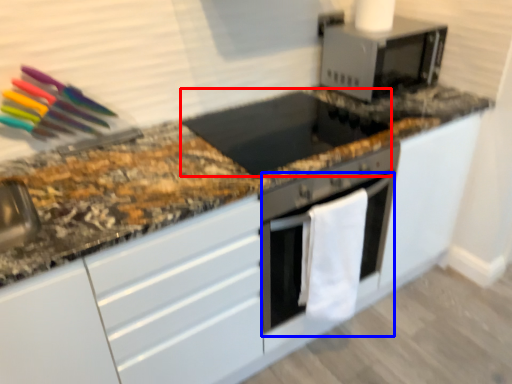
Question: Among these objects, which one is farthest to the camera, appliance (highlighted by a red box) or oven (highlighted by a blue box)?

Choices:
 (A) appliance
 (B) oven

Answer: (B)